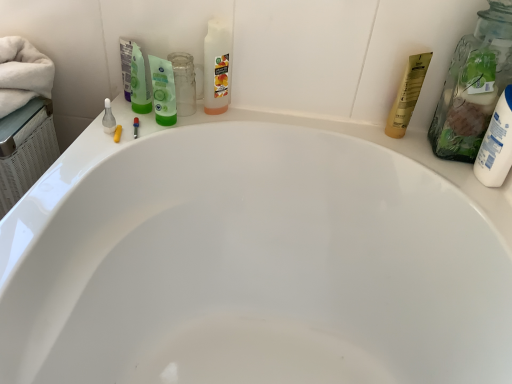
Question: Is white matte lotion at right, the 2th toiletry in the left-to-right sequence, to the left of yellow matte tube at upper right, the 2th toiletry viewed from the front, from the viewer's perspective?

Choices:
 (A) yes
 (B) no

Answer: (B)

Question: Is there a large distance between white matte lotion at right, marked as the first toiletry in a right-to-left arrangement, and yellow matte tube at upper right, the second toiletry from the right?

Choices:
 (A) no
 (B) yes

Answer: (A)

Question: From the image's perspective, would you say white matte lotion at right, the 2th toiletry in the left-to-right sequence, is shown under yellow matte tube at upper right, the 2th toiletry viewed from the front?

Choices:
 (A) no
 (B) yes

Answer: (B)

Question: Is white matte lotion at right, arranged as the second toiletry when viewed from the back, next to yellow matte tube at upper right, the first toiletry when ordered from back to front, and touching it?

Choices:
 (A) yes
 (B) no

Answer: (B)

Question: Does white matte lotion at right, marked as the first toiletry in a right-to-left arrangement, have a smaller size compared to yellow matte tube at upper right, the second toiletry from the right?

Choices:
 (A) yes
 (B) no

Answer: (B)

Question: Would you say white matte lotion at right, the 2th toiletry in the left-to-right sequence, contains yellow matte tube at upper right, the first toiletry when ordered from back to front?

Choices:
 (A) yes
 (B) no

Answer: (B)

Question: Is green matte mouthwash at upper center bigger than yellow matte tube at upper right, the first toiletry when ordered from back to front?

Choices:
 (A) no
 (B) yes

Answer: (A)

Question: From a real-world perspective, is green matte mouthwash at upper center physically above yellow matte tube at upper right, the first toiletry when ordered from back to front?

Choices:
 (A) yes
 (B) no

Answer: (B)

Question: Can you confirm if green matte mouthwash at upper center is positioned to the right of yellow matte tube at upper right, placed as the first toiletry when sorted from left to right?

Choices:
 (A) yes
 (B) no

Answer: (B)

Question: Is green matte mouthwash at upper center not near yellow matte tube at upper right, placed as the first toiletry when sorted from left to right?

Choices:
 (A) yes
 (B) no

Answer: (B)

Question: Is green matte mouthwash at upper center placed right next to yellow matte tube at upper right, the second toiletry from the right?

Choices:
 (A) no
 (B) yes

Answer: (A)

Question: Does green matte mouthwash at upper center have a lesser width compared to yellow matte tube at upper right, the second toiletry from the right?

Choices:
 (A) yes
 (B) no

Answer: (A)

Question: Does yellow matte tube at upper right, the first toiletry when ordered from back to front, have a greater height compared to white matte lotion at right, the 2th toiletry in the left-to-right sequence?

Choices:
 (A) no
 (B) yes

Answer: (B)